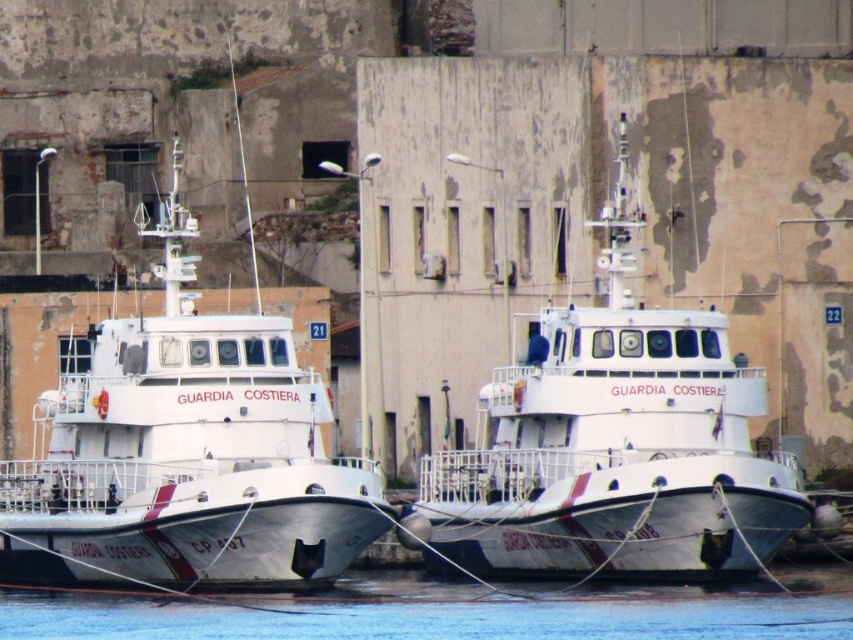
You are an observer standing on the dock and looking at the white glossy boat at left and the blue water at lower center. Which object is taller?

The white glossy boat at left is taller than the blue water at lower center.